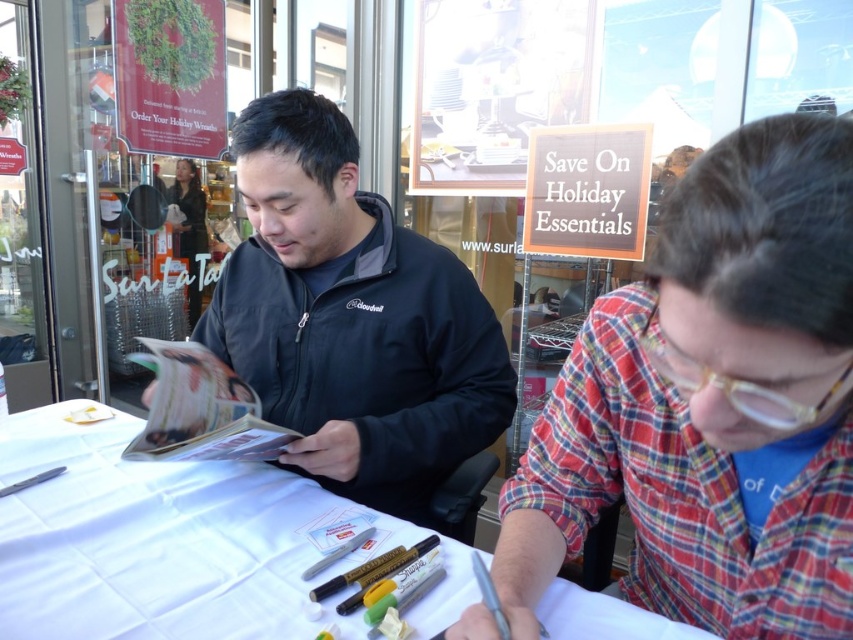
Consider the image. Is plaid shirt at right above white paper at center?

Indeed, plaid shirt at right is positioned over white paper at center.

Is plaid shirt at right taller than white paper at center?

Yes, plaid shirt at right is taller than white paper at center.

Describe the element at coordinates (712, 403) in the screenshot. I see `plaid shirt at right` at that location.

Locate an element on the screen. The image size is (853, 640). plaid shirt at right is located at coordinates (712, 403).

Can you confirm if plaid shirt at right is wider than black matte jacket at center?

No, plaid shirt at right is not wider than black matte jacket at center.

The height and width of the screenshot is (640, 853). In order to click on plaid shirt at right in this screenshot , I will do `click(712, 403)`.

From the picture: Which is above, black matte jacket at center or white paper at center?

black matte jacket at center is above.

Does black matte jacket at center have a greater height compared to white paper at center?

Indeed, black matte jacket at center has a greater height compared to white paper at center.

Who is more distant from viewer, [399,304] or [228,541]?

The point [399,304] is more distant.

This screenshot has height=640, width=853. I want to click on black matte jacket at center, so click(x=351, y=317).